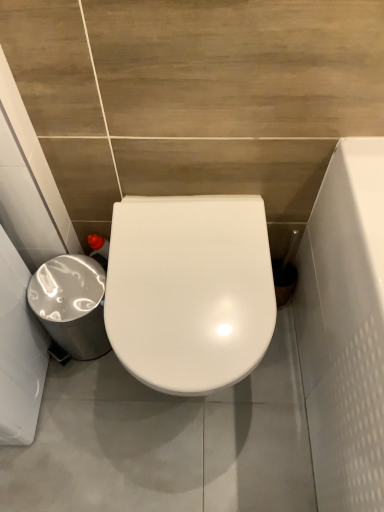
Question: From their relative heights in the image, would you say white glossy toilet at center is taller or shorter than silver metallic trash can at lower left?

Choices:
 (A) tall
 (B) short

Answer: (A)

Question: From the image's perspective, relative to silver metallic trash can at lower left, is white glossy toilet at center above or below?

Choices:
 (A) below
 (B) above

Answer: (A)

Question: Is white glossy toilet at center wider or thinner than silver metallic trash can at lower left?

Choices:
 (A) wide
 (B) thin

Answer: (A)

Question: Is point (38, 301) positioned closer to the camera than point (258, 216)?

Choices:
 (A) closer
 (B) farther

Answer: (B)

Question: From the image's perspective, is silver metallic trash can at lower left positioned above or below white glossy toilet at center?

Choices:
 (A) above
 (B) below

Answer: (A)

Question: Would you say silver metallic trash can at lower left is to the left or to the right of white glossy toilet at center in the picture?

Choices:
 (A) right
 (B) left

Answer: (B)

Question: From a real-world perspective, relative to white glossy toilet at center, is silver metallic trash can at lower left vertically above or below?

Choices:
 (A) below
 (B) above

Answer: (A)